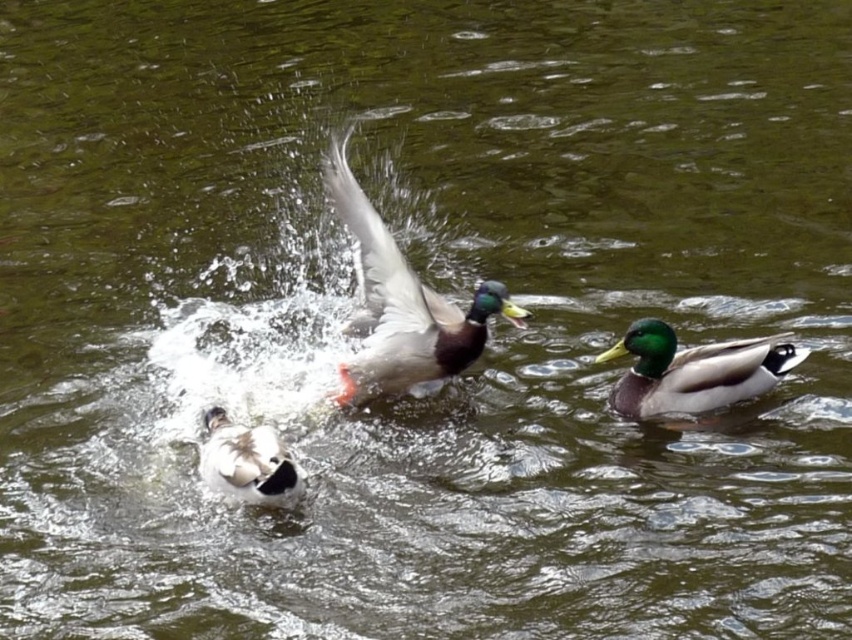
Question: Does shiny green duck at center appear on the left side of white fluffy duck at lower left?

Choices:
 (A) yes
 (B) no

Answer: (B)

Question: Does shiny green duck at center have a larger size compared to white fluffy duck at lower left?

Choices:
 (A) yes
 (B) no

Answer: (A)

Question: Which point is closer to the camera taking this photo?

Choices:
 (A) (626, 401)
 (B) (416, 314)
 (C) (213, 456)

Answer: (C)

Question: Considering the real-world distances, which object is closest to the shiny green duck at center?

Choices:
 (A) green glossy duck at right
 (B) white fluffy duck at lower left

Answer: (B)

Question: Can you confirm if shiny green duck at center is positioned to the right of white fluffy duck at lower left?

Choices:
 (A) no
 (B) yes

Answer: (B)

Question: Considering the real-world distances, which object is farthest from the green glossy duck at right?

Choices:
 (A) shiny green duck at center
 (B) white fluffy duck at lower left

Answer: (B)